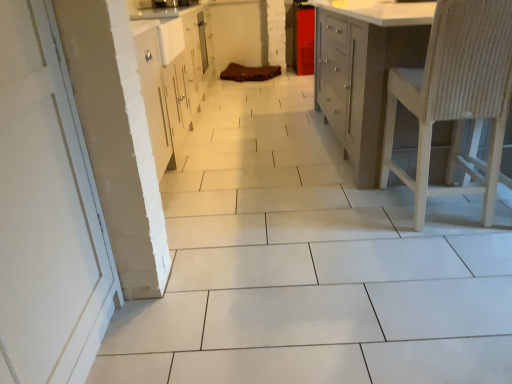
Identify the location of woven wood chair at right. The height and width of the screenshot is (384, 512). (455, 96).

The height and width of the screenshot is (384, 512). Describe the element at coordinates (455, 96) in the screenshot. I see `woven wood chair at right` at that location.

Where is `woven wood chair at right`? The height and width of the screenshot is (384, 512). woven wood chair at right is located at coordinates (455, 96).